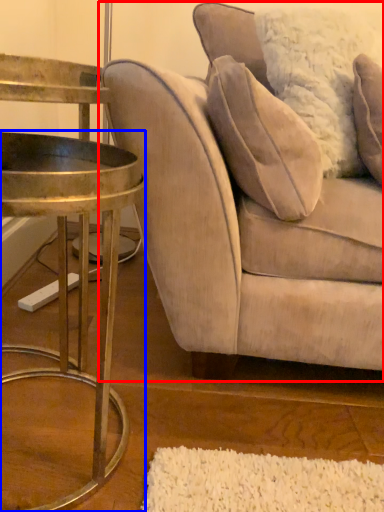
Question: Which object is further to the camera taking this photo, studio couch (highlighted by a red box) or table (highlighted by a blue box)?

Choices:
 (A) studio couch
 (B) table

Answer: (A)